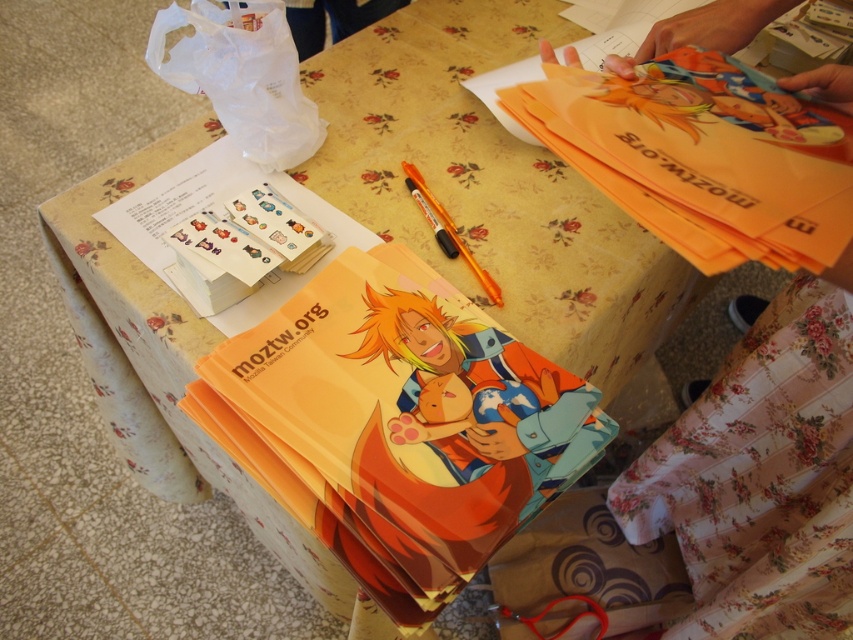
Question: From the image, what is the correct spatial relationship of orange plastic pen at center in relation to metallic orange scissors at lower center?

Choices:
 (A) right
 (B) left

Answer: (B)

Question: Among these points, which one is farthest from the camera?

Choices:
 (A) (589, 602)
 (B) (438, 216)

Answer: (A)

Question: In this image, where is orange plastic pen at center located relative to metallic orange scissors at lower center?

Choices:
 (A) above
 (B) below

Answer: (A)

Question: Can you confirm if orange plastic pen at center is positioned to the right of metallic orange scissors at lower center?

Choices:
 (A) no
 (B) yes

Answer: (A)